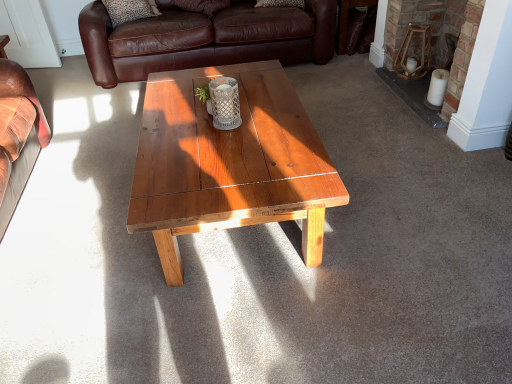
Question: Is leopard print fabric pillow at upper left not inside wooden stool at upper right?

Choices:
 (A) no
 (B) yes

Answer: (B)

Question: Can you confirm if leopard print fabric pillow at upper left is thinner than wooden stool at upper right?

Choices:
 (A) no
 (B) yes

Answer: (B)

Question: Does leopard print fabric pillow at upper left appear on the left side of wooden stool at upper right?

Choices:
 (A) no
 (B) yes

Answer: (B)

Question: Does leopard print fabric pillow at upper left have a larger size compared to wooden stool at upper right?

Choices:
 (A) no
 (B) yes

Answer: (A)

Question: From the image's perspective, does leopard print fabric pillow at upper left appear lower than wooden stool at upper right?

Choices:
 (A) no
 (B) yes

Answer: (A)

Question: Is leopard print fabric pillow at upper left closer to camera compared to wooden stool at upper right?

Choices:
 (A) yes
 (B) no

Answer: (B)

Question: Considering the relative sizes of wooden stool at upper right and brown leather couch at upper center in the image provided, is wooden stool at upper right bigger than brown leather couch at upper center?

Choices:
 (A) yes
 (B) no

Answer: (B)

Question: Is wooden stool at upper right further to camera compared to brown leather couch at upper center?

Choices:
 (A) yes
 (B) no

Answer: (B)

Question: From a real-world perspective, is wooden stool at upper right on brown leather couch at upper center?

Choices:
 (A) no
 (B) yes

Answer: (A)

Question: Does wooden stool at upper right have a greater height compared to brown leather couch at upper center?

Choices:
 (A) yes
 (B) no

Answer: (B)

Question: Is wooden stool at upper right looking in the opposite direction of brown leather couch at upper center?

Choices:
 (A) yes
 (B) no

Answer: (B)

Question: Could you tell me if wooden stool at upper right is turned towards brown leather couch at upper center?

Choices:
 (A) yes
 (B) no

Answer: (B)

Question: From the image's perspective, would you say brick fireplace at right is shown under brown leather couch at upper center?

Choices:
 (A) no
 (B) yes

Answer: (B)